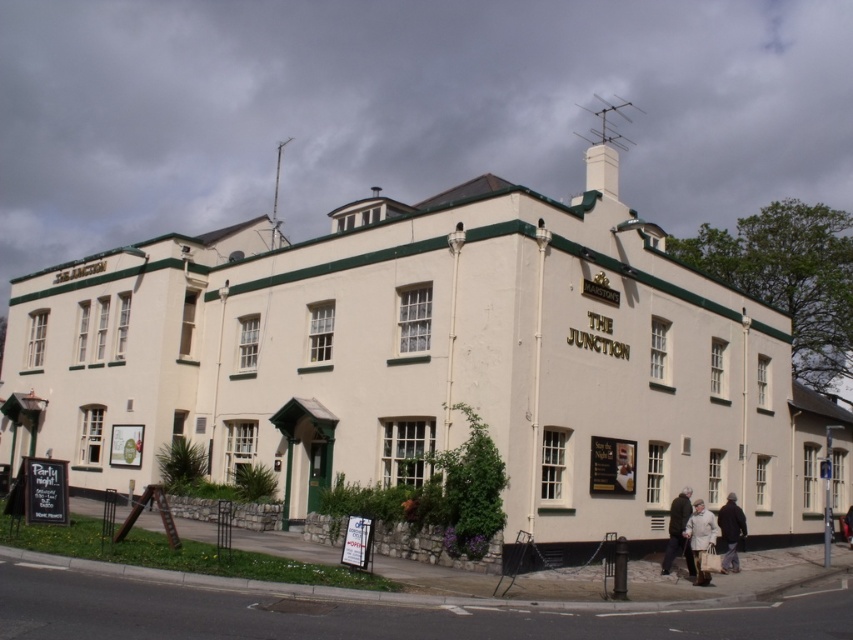
Is white painted building at center in front of dark brown leather coat at lower right?

That is True.

From the picture: Is white painted building at center to the left of dark brown leather coat at lower right from the viewer's perspective?

Yes, white painted building at center is to the left of dark brown leather coat at lower right.

Who is more forward, (183, 284) or (668, 566)?

Point (668, 566) is in front.

At what (x,y) coordinates should I click in order to perform the action: click on white painted building at center. Please return your answer as a coordinate pair (x, y). Looking at the image, I should click on (434, 362).

Which is below, dark brown leather coat at lower right or dark gray jacket at lower right?

dark gray jacket at lower right is lower down.

Between dark brown leather coat at lower right and dark gray jacket at lower right, which one has less height?

With less height is dark brown leather coat at lower right.

Identify the location of dark brown leather coat at lower right. Image resolution: width=853 pixels, height=640 pixels. (677, 532).

Who is positioned more to the right, white wool coat at lower right or dark gray jacket at lower right?

Positioned to the right is dark gray jacket at lower right.

Is white wool coat at lower right positioned behind dark gray jacket at lower right?

No, it is in front of dark gray jacket at lower right.

Where is `white wool coat at lower right`? The width and height of the screenshot is (853, 640). white wool coat at lower right is located at coordinates (700, 538).